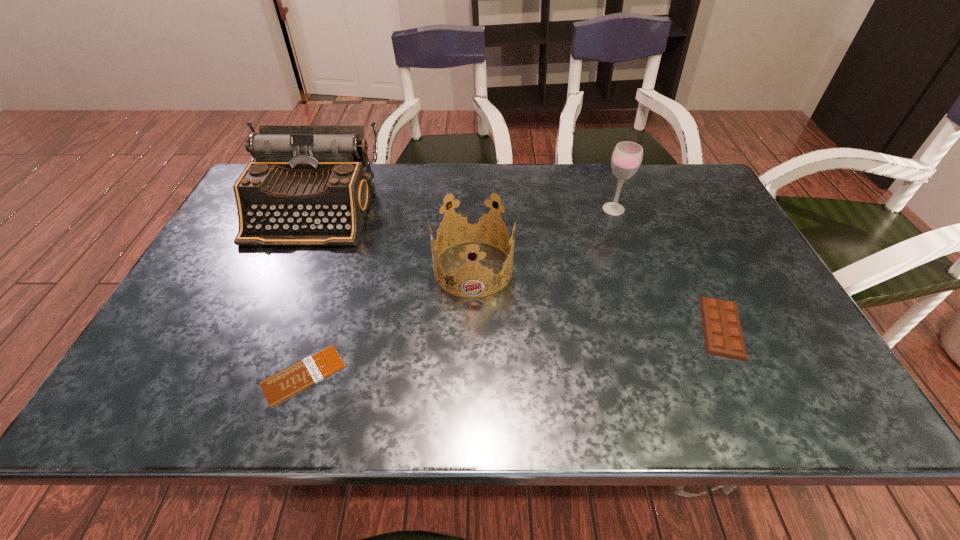
Where is `vacant space at the left edge of the desktop`? This screenshot has width=960, height=540. vacant space at the left edge of the desktop is located at coordinates (231, 328).

Find the location of a particular element. The image size is (960, 540). blank space at the right edge is located at coordinates (727, 221).

Locate an element on the screen. The width and height of the screenshot is (960, 540). free spot at the near left corner of the desktop is located at coordinates (159, 386).

Locate an element on the screen. The width and height of the screenshot is (960, 540). free spot between the wineglass and the crown is located at coordinates (543, 239).

Where is `blank region between the rightmost object and the crown`? This screenshot has height=540, width=960. blank region between the rightmost object and the crown is located at coordinates (597, 298).

Where is `free space that is in between the left chocolate bar and the typewriter`? The height and width of the screenshot is (540, 960). free space that is in between the left chocolate bar and the typewriter is located at coordinates (308, 292).

Where is `empty space that is in between the crown and the fourth tallest object`? empty space that is in between the crown and the fourth tallest object is located at coordinates (597, 298).

At what (x,y) coordinates should I click in order to perform the action: click on empty space that is in between the fourth object from left to right and the rightmost object. Please return your answer as a coordinate pair (x, y). Looking at the image, I should click on (668, 268).

At what (x,y) coordinates should I click in order to perform the action: click on free spot between the third object from right to left and the wineglass. Please return your answer as a coordinate pair (x, y). Looking at the image, I should click on (543, 239).

At what (x,y) coordinates should I click in order to perform the action: click on vacant area that lies between the typewriter and the left chocolate bar. Please return your answer as a coordinate pair (x, y). The width and height of the screenshot is (960, 540). Looking at the image, I should click on (308, 292).